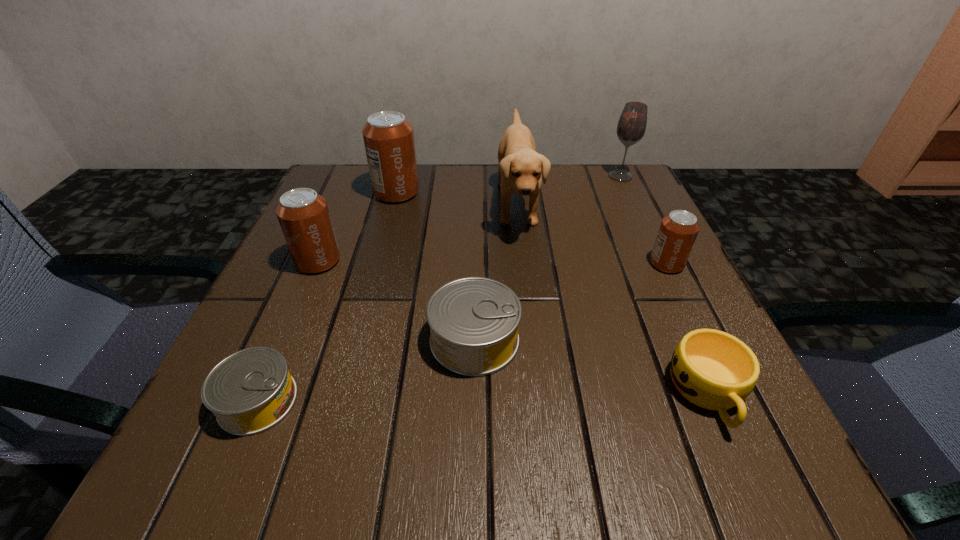
This screenshot has width=960, height=540. In order to click on vacant point at the near right corner in this screenshot , I will do `click(794, 484)`.

Find the location of a particular element. The height and width of the screenshot is (540, 960). vacant area that lies between the shortest can and the farthest orange can is located at coordinates (327, 297).

Locate an element on the screen. free space between the puppy and the left silver can is located at coordinates (387, 302).

You are a GUI agent. You are given a task and a screenshot of the screen. Output one action in this format:
    pyautogui.click(x=<x>, y=<y>)
    Task: Click on the vacant area that lies between the second biggest orange can and the left silver can
    This screenshot has height=540, width=960.
    Given the screenshot: What is the action you would take?
    pyautogui.click(x=288, y=331)

What are the coordinates of `vacant space in between the smallest orange can and the farthest can` in the screenshot? It's located at (532, 228).

Where is `vacant space that's between the third object from left to right and the rightmost orange can`? vacant space that's between the third object from left to right and the rightmost orange can is located at coordinates (532, 228).

At what (x,y) coordinates should I click in order to perform the action: click on unoccupied position between the fourth shortest can and the fifth tallest object. Please return your answer as a coordinate pair (x, y). Looking at the image, I should click on (492, 262).

At what (x,y) coordinates should I click in order to perform the action: click on free point between the glass drink container and the leftmost orange can. Please return your answer as a coordinate pair (x, y). The width and height of the screenshot is (960, 540). Looking at the image, I should click on (469, 219).

This screenshot has width=960, height=540. I want to click on vacant point located between the cup and the beige puppy, so click(x=612, y=298).

Where is `free point between the beige cup and the smaller silver can`? Image resolution: width=960 pixels, height=540 pixels. free point between the beige cup and the smaller silver can is located at coordinates (483, 397).